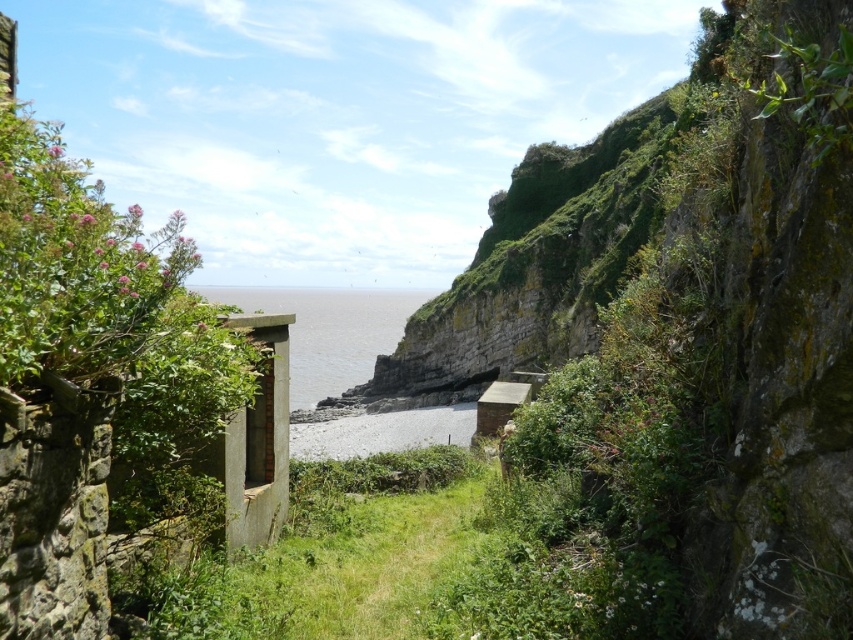
Is point (349, 333) positioned after point (403, 428)?

Yes, it is behind point (403, 428).

Where is `clear blue water at center`? The height and width of the screenshot is (640, 853). clear blue water at center is located at coordinates (328, 332).